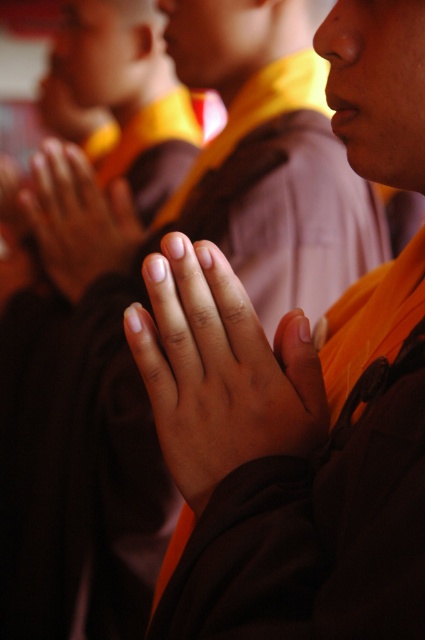
You are an observer looking at the image of hands in prayer. The scene shows smooth skin hands at center and matte orange cloth at center. Which object is positioned to the right?

The smooth skin hands at center is to the right of matte orange cloth at center.

You are designing a poster for a meditation retreat and need to highlight the hands and the orange cloth in the scene. Given the sizes of the smooth skin hands at center and the matte orange cloth at center, which object should you magnify to emphasize their relationship without changing their positions?

The smooth skin hands at center is smaller than the matte orange cloth at center, so to emphasize their relationship without changing positions, you should magnify the smooth skin hands at center to make it appear larger relative to the matte orange cloth at center.